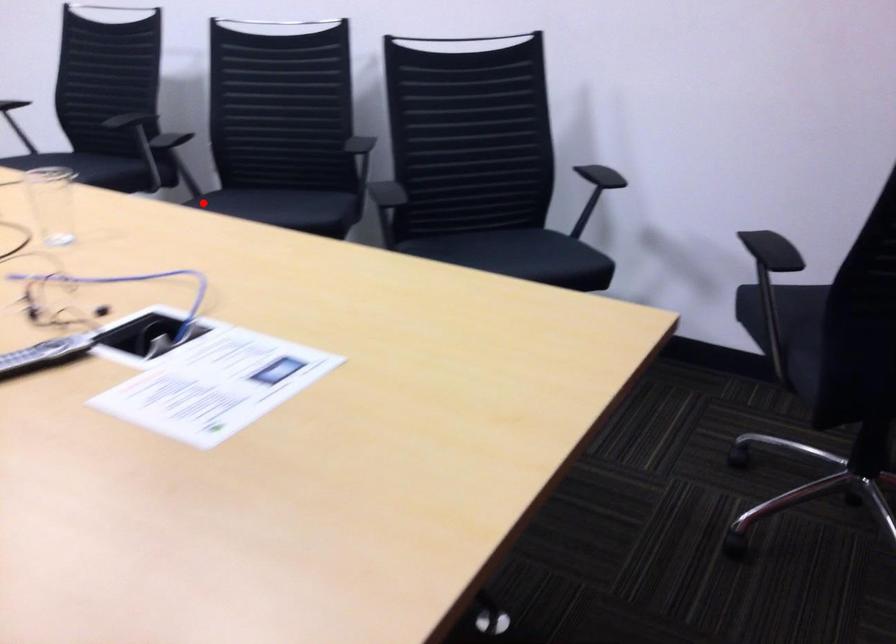
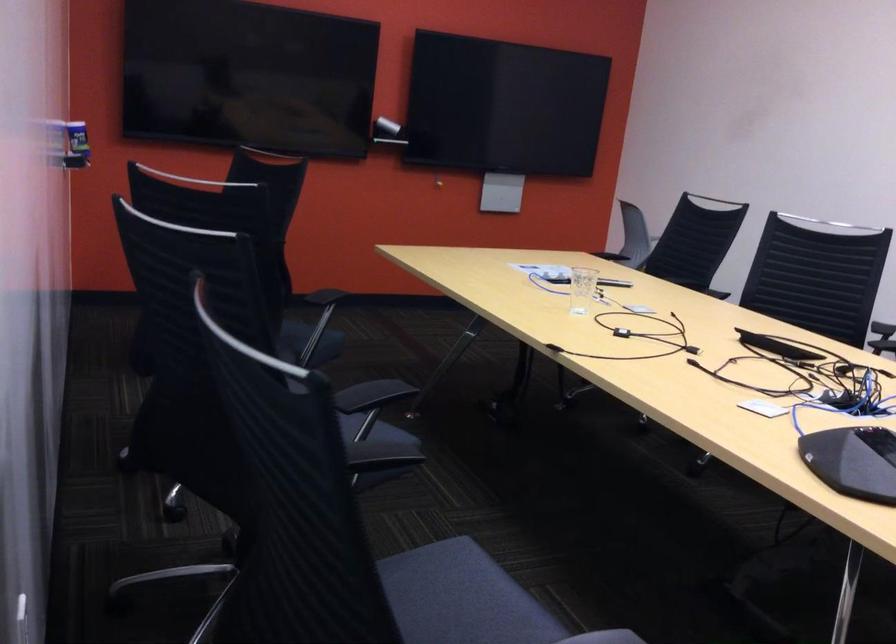
Find the pixel in the second image that matches the highlighted location in the first image.

(374, 430)